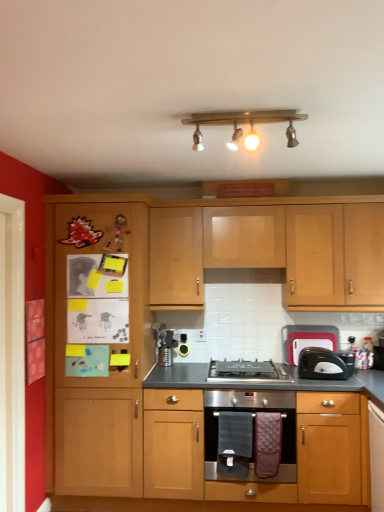
At what (x,y) coordinates should I click in order to perform the action: click on wooden cabinet at left. Please return your answer as a coordinate pair (x, y). Image resolution: width=384 pixels, height=512 pixels. Looking at the image, I should click on (108, 358).

The image size is (384, 512). What do you see at coordinates (247, 433) in the screenshot? I see `stainless steel oven at center` at bounding box center [247, 433].

The width and height of the screenshot is (384, 512). I want to click on white glossy door at left, so click(x=12, y=354).

Locate an element on the screen. wooden cabinet at left is located at coordinates (108, 358).

Is black plastic toaster at right bigger than wooden cabinet at left?

Actually, black plastic toaster at right might be smaller than wooden cabinet at left.

What's the angular difference between black plastic toaster at right and wooden cabinet at left's facing directions?

They differ by 0.00149 degrees in their facing directions.

You are a GUI agent. You are given a task and a screenshot of the screen. Output one action in this format:
    pyautogui.click(x=<x>, y=<y>)
    Task: Click on the file cabinet above the black plastic toaster at right (from a real-world perspective)
    Image resolution: width=384 pixels, height=512 pixels.
    Given the screenshot: What is the action you would take?
    (108, 358)

From a real-world perspective, is black plastic toaster at right located higher than wooden cabinet at left?

Incorrect, from a real-world perspective, black plastic toaster at right is lower than wooden cabinet at left.

In terms of width, does black plastic toaster at right look wider or thinner when compared to wooden light fixture at upper center?

In the image, black plastic toaster at right appears to be wider than wooden light fixture at upper center.

Considering the points (327, 351) and (248, 148), which point is behind, point (327, 351) or point (248, 148)?

The point (327, 351) is more distant.

Between black plastic toaster at right and wooden light fixture at upper center, which one has larger size?

wooden light fixture at upper center is bigger.

Where is `lamp in front of the stainless steel oven at center`? This screenshot has width=384, height=512. lamp in front of the stainless steel oven at center is located at coordinates (244, 123).

From a real-world perspective, is wooden light fixture at upper center positioned above or below stainless steel oven at center?

From a real-world perspective, wooden light fixture at upper center is physically above stainless steel oven at center.

From the image's perspective, is wooden light fixture at upper center on top of stainless steel oven at center?

Yes, from the image's perspective, wooden light fixture at upper center is on top of stainless steel oven at center.

Considering the points (195, 143) and (218, 434), which point is behind, point (195, 143) or point (218, 434)?

Point (218, 434)

Does black plastic toaster at right appear on the right side of stainless steel gas stove at center?

Yes.

Where is `gas stove located underneath the black plastic toaster at right (from a real-world perspective)`? gas stove located underneath the black plastic toaster at right (from a real-world perspective) is located at coordinates (246, 371).

Is black plastic toaster at right completely or partially outside of stainless steel gas stove at center?

Indeed, black plastic toaster at right is completely outside stainless steel gas stove at center.

Looking at this image, is black plastic toaster at right not near stainless steel gas stove at center?

No, black plastic toaster at right is in close proximity to stainless steel gas stove at center.

Is point (216, 234) closer to viewer compared to point (19, 384)?

That is False.

Is light wood cabinet at upper center, the first cabinetry in the top-to-bottom sequence, facing away from white glossy door at left?

No, light wood cabinet at upper center, the first cabinetry in the top-to-bottom sequence, is not facing away from white glossy door at left.

In terms of size, does light wood cabinet at upper center, the first cabinetry in the top-to-bottom sequence, appear bigger or smaller than white glossy door at left?

Considering their sizes, light wood cabinet at upper center, the first cabinetry in the top-to-bottom sequence, takes up more space than white glossy door at left.

Considering the sizes of objects light wood cabinet at upper center, the first cabinetry in the top-to-bottom sequence, and white glossy door at left in the image provided, who is wider, light wood cabinet at upper center, the first cabinetry in the top-to-bottom sequence, or white glossy door at left?

Wider between the two is light wood cabinet at upper center, the first cabinetry in the top-to-bottom sequence.

Are white glossy door at left and wooden light fixture at upper center beside each other?

No.

You are a GUI agent. You are given a task and a screenshot of the screen. Output one action in this format:
    pyautogui.click(x=<x>, y=<y>)
    Task: Click on the glass door below the wooden light fixture at upper center (from the image's perspective)
    The image size is (384, 512).
    Given the screenshot: What is the action you would take?
    pyautogui.click(x=12, y=354)

Do you think white glossy door at left is within wooden light fixture at upper center, or outside of it?

white glossy door at left cannot be found inside wooden light fixture at upper center.

Considering the relative positions of white glossy door at left and wooden light fixture at upper center in the image provided, is white glossy door at left in front of wooden light fixture at upper center?

No, white glossy door at left is behind wooden light fixture at upper center.

Which object is positioned more to the left, black plastic toaster at right or wooden cabinet at left?

From the viewer's perspective, wooden cabinet at left appears more on the left side.

Who is shorter, black plastic toaster at right or wooden cabinet at left?

black plastic toaster at right is shorter.

Based on the photo, from a real-world perspective, who is located higher, black plastic toaster at right or wooden cabinet at left?

Answer: wooden cabinet at left is physically above.

Is black plastic toaster at right not close to wooden cabinet at left?

That's right, there is a large distance between black plastic toaster at right and wooden cabinet at left.

Locate an element on the screen. Image resolution: width=384 pixels, height=512 pixels. toaster below the wooden cabinet at left (from the image's perspective) is located at coordinates tap(324, 364).

Where is `lamp located in front of the black plastic toaster at right`? The width and height of the screenshot is (384, 512). lamp located in front of the black plastic toaster at right is located at coordinates (244, 123).

From the picture: When comparing their distances from wooden cabinet at left, does black plastic toaster at right or matte wood oven at center, which is the 2th cabinetry in top-to-bottom order, seem closer?

The object closer to wooden cabinet at left is matte wood oven at center, which is the 2th cabinetry in top-to-bottom order.

Estimate the real-world distances between objects in this image. Which object is closer to light wood cabinet at upper center, the first cabinetry in the top-to-bottom sequence, white glossy door at left or black plastic toaster at right?

Based on the image, black plastic toaster at right appears to be nearer to light wood cabinet at upper center, the first cabinetry in the top-to-bottom sequence.

In the scene shown: Which object lies nearer to the anchor point wooden light fixture at upper center, stainless steel oven at center or black plastic toaster at right?

Based on the image, black plastic toaster at right appears to be nearer to wooden light fixture at upper center.

Looking at this image, from the image, which object appears to be farther from matte wood oven at center, which is the 2th cabinetry in top-to-bottom order, stainless steel oven at center or wooden light fixture at upper center?

The object further to matte wood oven at center, which is the 2th cabinetry in top-to-bottom order, is wooden light fixture at upper center.

From the picture: Estimate the real-world distances between objects in this image. Which object is closer to black plastic toaster at right, wooden cabinet at left or stainless steel gas stove at center?

stainless steel gas stove at center.

Based on their spatial positions, is matte wood oven at center, which is the 2th cabinetry in top-to-bottom order, or stainless steel gas stove at center further from white glossy door at left?

stainless steel gas stove at center is positioned further to the anchor white glossy door at left.

From the image, which object appears to be farther from black plastic toaster at right, stainless steel gas stove at center or matte wood oven at center, arranged as the first cabinetry when ordered from the bottom?

matte wood oven at center, arranged as the first cabinetry when ordered from the bottom, lies further to black plastic toaster at right than the other object.

Considering their positions, is black plastic toaster at right positioned closer to stainless steel gas stove at center than wooden light fixture at upper center?

The object closer to stainless steel gas stove at center is black plastic toaster at right.

Find the location of `kitchen appliance located between wooden cabinet at left and matte wood oven at center, arranged as the first cabinetry when ordered from the bottom, in the left-right direction`. kitchen appliance located between wooden cabinet at left and matte wood oven at center, arranged as the first cabinetry when ordered from the bottom, in the left-right direction is located at coordinates (247, 433).

The image size is (384, 512). Identify the location of toaster positioned between wooden light fixture at upper center and light wood cabinet at upper center, placed as the second cabinetry when sorted from bottom to top, from near to far. (324, 364).

The image size is (384, 512). Identify the location of file cabinet located between white glossy door at left and matte wood oven at center, arranged as the first cabinetry when ordered from the bottom, in the left-right direction. (108, 358).

You are a GUI agent. You are given a task and a screenshot of the screen. Output one action in this format:
    pyautogui.click(x=<x>, y=<y>)
    Task: Click on the gas stove between wooden cabinet at left and black plastic toaster at right from left to right
    The image size is (384, 512).
    Given the screenshot: What is the action you would take?
    [246, 371]